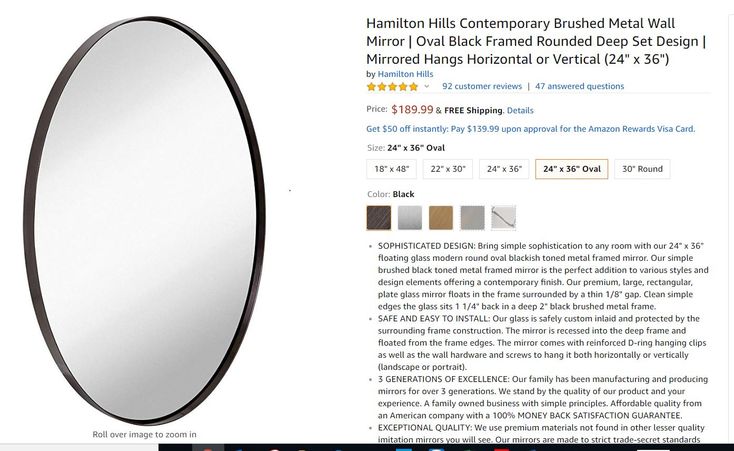
Find the location of `border of mirror`. border of mirror is located at coordinates (219, 66).